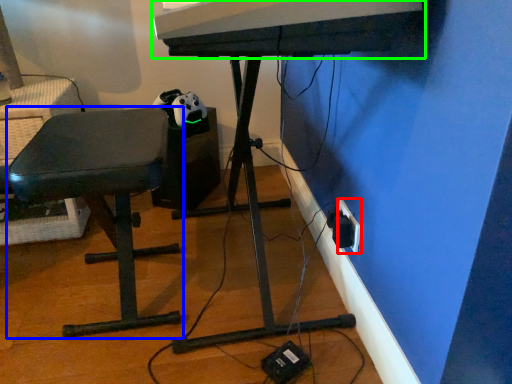
Question: Considering the real-world distances, which object is farthest from electric outlet (highlighted by a red box)? furniture (highlighted by a blue box) or musical keyboard (highlighted by a green box)?

Choices:
 (A) furniture
 (B) musical keyboard

Answer: (A)